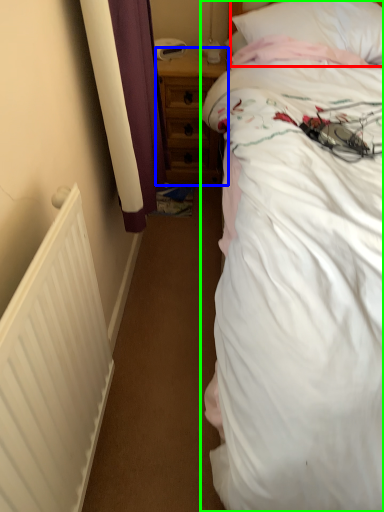
Question: Which is nearer to the pillow (highlighted by a red box)? nightstand (highlighted by a blue box) or bed (highlighted by a green box).

Choices:
 (A) nightstand
 (B) bed

Answer: (B)